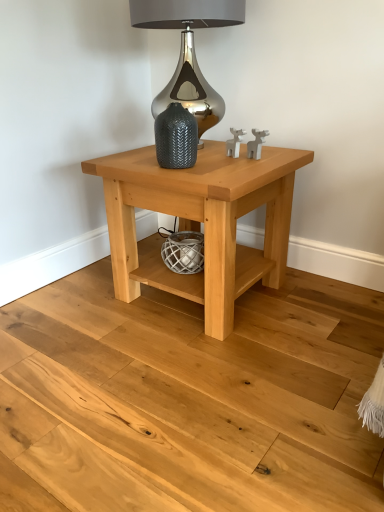
I want to click on free location to the left of textured gray vase at center, so click(x=130, y=163).